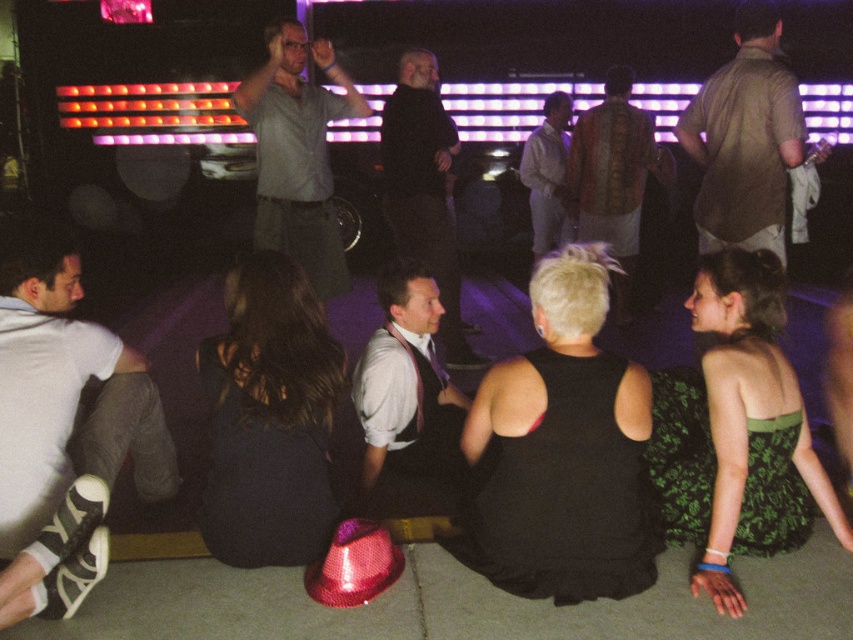
Who is more distant from viewer, (561, 387) or (306, 308)?

The point (306, 308) is more distant.

Who is lower down, black satin dress at center or dark fabric dress at center?

Positioned lower is black satin dress at center.

Which is in front, point (573, 440) or point (308, 413)?

Point (573, 440)

I want to click on black satin dress at center, so click(561, 451).

Who is taller, light brown shirt at upper right or patterned fabric shirt at center?

patterned fabric shirt at center is taller.

Is light brown shirt at upper right to the right of patterned fabric shirt at center from the viewer's perspective?

No, light brown shirt at upper right is not to the right of patterned fabric shirt at center.

Is point (756, 168) positioned after point (624, 320)?

No, (756, 168) is closer to viewer.

In order to click on light brown shirt at upper right in this screenshot , I will do `click(746, 140)`.

Can you confirm if white satin shirt at center is shorter than patterned fabric shirt at center?

Yes.

Is white satin shirt at center to the right of patterned fabric shirt at center from the viewer's perspective?

Incorrect, white satin shirt at center is not on the right side of patterned fabric shirt at center.

Image resolution: width=853 pixels, height=640 pixels. I want to click on white satin shirt at center, so (407, 400).